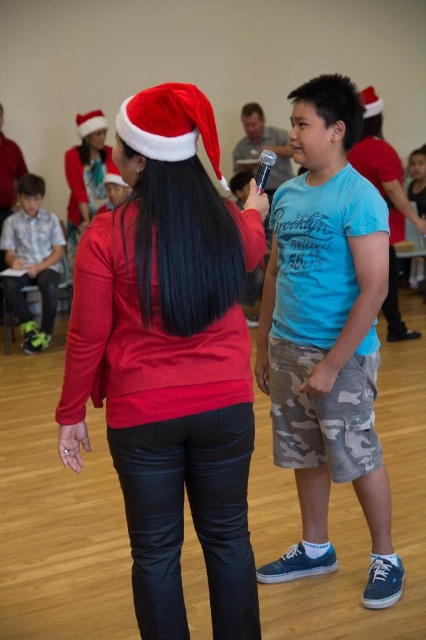
From the picture: Does matte red santa hat at upper center have a larger size compared to red santa hat at upper left?

Correct, matte red santa hat at upper center is larger in size than red santa hat at upper left.

Which is in front, point (400, 170) or point (78, 136)?

Point (400, 170)

I want to click on matte red santa hat at upper center, so click(x=388, y=209).

At what (x,y) coordinates should I click in order to perform the action: click on matte red sweater at center. Please return your answer as a coordinate pair (x, y). Looking at the image, I should click on (169, 358).

Is matte red sweater at center taller than red santa hat at upper left?

Yes, matte red sweater at center is taller than red santa hat at upper left.

The width and height of the screenshot is (426, 640). What do you see at coordinates (169, 358) in the screenshot?
I see `matte red sweater at center` at bounding box center [169, 358].

Where is `matte red sweater at center`? The height and width of the screenshot is (640, 426). matte red sweater at center is located at coordinates (169, 358).

Can you confirm if matte red santa hat at upper left is positioned to the right of red santa hat at upper left?

Indeed, matte red santa hat at upper left is positioned on the right side of red santa hat at upper left.

Which is behind, point (91, 150) or point (92, 116)?

The point (92, 116) is more distant.

Describe the element at coordinates (86, 177) in the screenshot. Image resolution: width=426 pixels, height=640 pixels. I see `matte red santa hat at upper left` at that location.

The height and width of the screenshot is (640, 426). I want to click on matte red santa hat at upper left, so click(x=86, y=177).